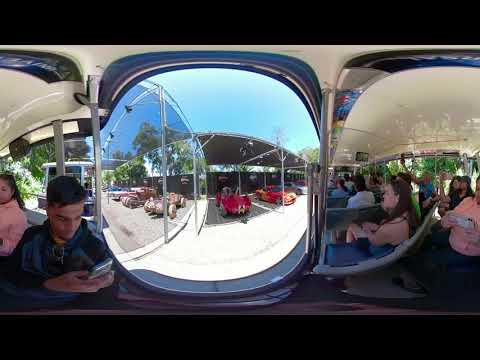
This screenshot has height=360, width=480. Identify the location of reading material. (461, 223).